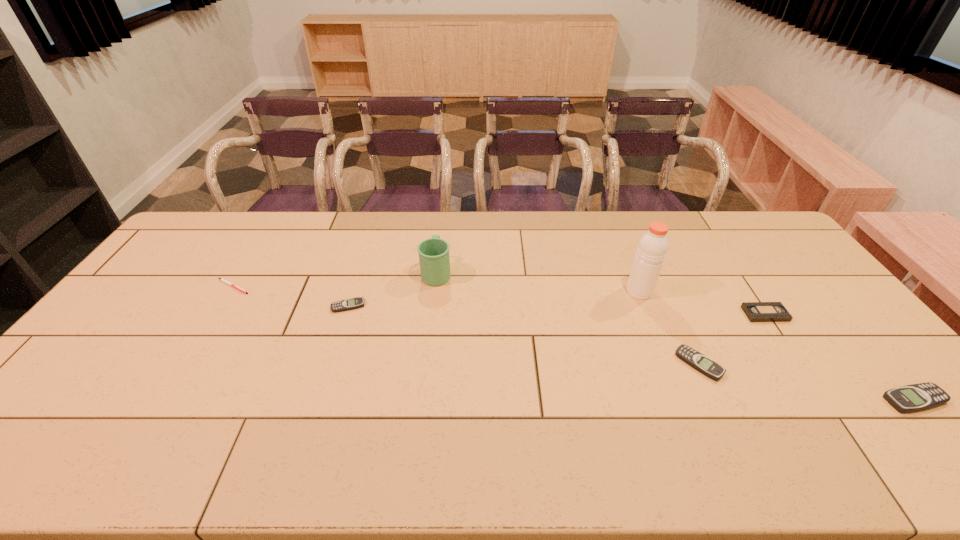
Point out which object is positioned as the fourth nearest to the second object from right to left. Please provide its 2D coordinates. Your answer should be formatted as a tuple, i.e. [(x, y)], where the tuple contains the x and y coordinates of a point satisfying the conditions above.

[(434, 259)]

Select which beeper appears as the second closest to the second object from right to left. Please provide its 2D coordinates. Your answer should be formatted as a tuple, i.e. [(x, y)], where the tuple contains the x and y coordinates of a point satisfying the conditions above.

[(916, 397)]

Select which beeper appears as the second closest to the tallest object. Please provide its 2D coordinates. Your answer should be formatted as a tuple, i.e. [(x, y)], where the tuple contains the x and y coordinates of a point satisfying the conditions above.

[(916, 397)]

Where is `vacant position in the image that satisfies the following two spatial constraints: 1. on the clicker of the pen; 2. on the back side of the second farthest beeper`? vacant position in the image that satisfies the following two spatial constraints: 1. on the clicker of the pen; 2. on the back side of the second farthest beeper is located at coordinates (184, 364).

At what (x,y) coordinates should I click in order to perform the action: click on vacant point that satisfies the following two spatial constraints: 1. on the clicker of the leftmost object; 2. on the right side of the farthest beeper. Please return your answer as a coordinate pair (x, y). Looking at the image, I should click on (220, 306).